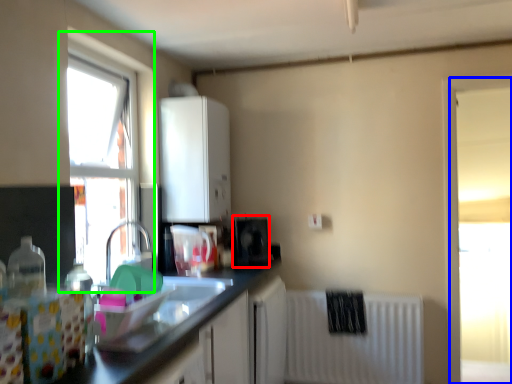
Question: Which is farther away from appliance (highlighted by a red box)? window (highlighted by a blue box) or window (highlighted by a green box)?

Choices:
 (A) window
 (B) window

Answer: (A)